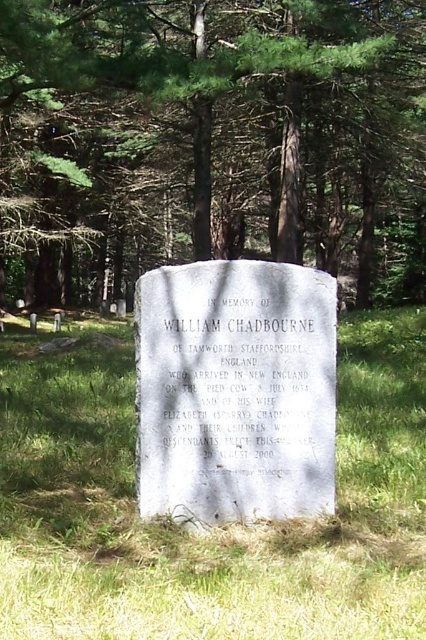
You are standing in a cemetery and see the tombstone with the green leafy tree at center and the green grass at center. Which object is taller?

The green leafy tree at center is taller than the green grass at center.

You are standing 10 meters away from the green leafy tree at center. Can you walk directly to the tombstone without moving closer than 8 meters to the tree?

The green leafy tree at center is 8.19 meters away from the viewer. Since you are standing 10 meters away from the tree, you are already beyond the 8 meters distance. Therefore, you can walk directly to the tombstone without moving closer than 8 meters to the tree.

Based on the scene description and the coordinates provided, what object is located at the coordinate point (212, 140)?

The point at coordinate (212, 140) indicates a green leafy tree at center.